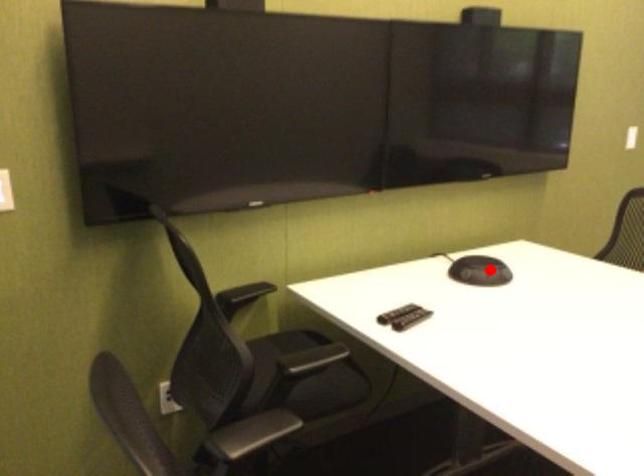
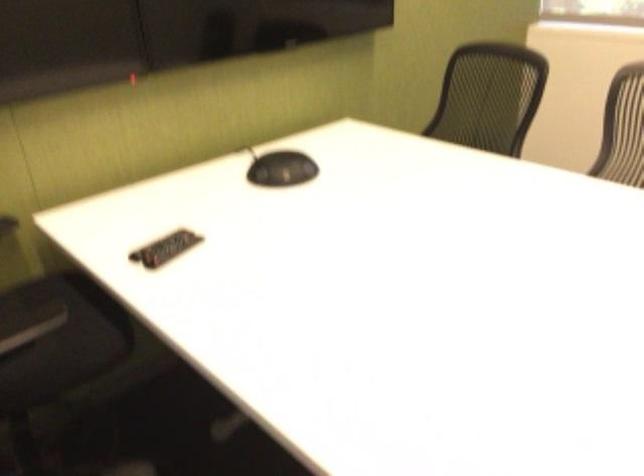
The point at the highlighted location is marked in the first image. Where is the corresponding point in the second image?

(281, 169)